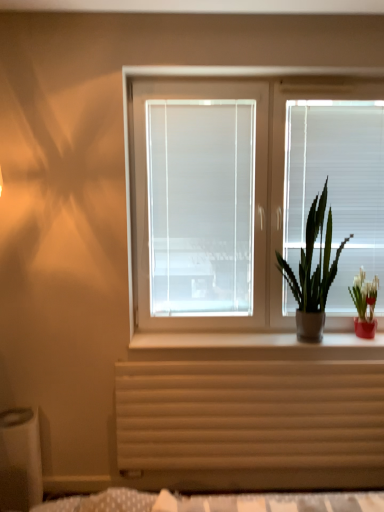
What are the coordinates of `vacant area on top of white matte window box at lower left (from a real-world perspective)` in the screenshot? It's located at (16, 418).